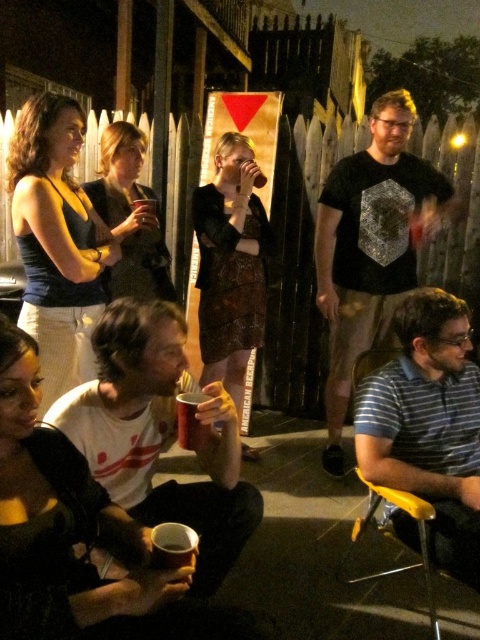
Question: Which point appears farthest from the camera in this image?

Choices:
 (A) pos(196,429)
 (B) pos(136,211)
 (C) pos(339,196)

Answer: (C)

Question: Is yellow plastic chair at lower right positioned in front of translucent plastic cup at center?

Choices:
 (A) no
 (B) yes

Answer: (B)

Question: Which point is closer to the camera taking this photo?

Choices:
 (A) (155, 212)
 (B) (157, 397)
 (C) (396, 572)

Answer: (B)

Question: Does black matte t-shirt at center lie in front of metallic silver cup at lower center?

Choices:
 (A) yes
 (B) no

Answer: (B)

Question: Based on their relative distances, which object is farther from the yellow plastic chair at lower right?

Choices:
 (A) black matte t-shirt at center
 (B) white matte cup at lower center
 (C) metallic silver cup at lower center
 (D) white matte t-shirt at lower left

Answer: (A)

Question: In this image, where is yellow plastic chair at lower right located relative to white matte cup at lower center?

Choices:
 (A) left
 (B) right

Answer: (B)